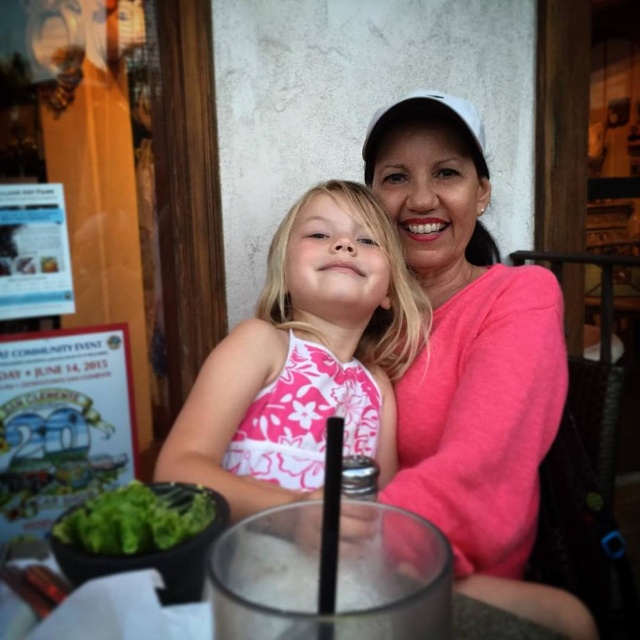
Looking at this image, is pink floral dress at center closer to the viewer compared to green leafy vegetable at lower left?

No, pink floral dress at center is further to the viewer.

Who is more distant from viewer, [205,445] or [148,492]?

The point [205,445] is behind.

Locate an element on the screen. This screenshot has width=640, height=640. pink floral dress at center is located at coordinates (304, 356).

Which is more to the right, pink cotton sweater at upper right or pink floral dress at center?

pink cotton sweater at upper right

Consider the image. Is pink cotton sweater at upper right shorter than pink floral dress at center?

In fact, pink cotton sweater at upper right may be taller than pink floral dress at center.

Is point (486, 420) positioned behind point (340, 236)?

That is False.

Identify the location of pink cotton sweater at upper right. The height and width of the screenshot is (640, 640). (472, 358).

Who is taller, pink cotton sweater at upper right or green leafy vegetable at lower left?

pink cotton sweater at upper right is taller.

Locate an element on the screen. This screenshot has height=640, width=640. pink cotton sweater at upper right is located at coordinates (472, 358).